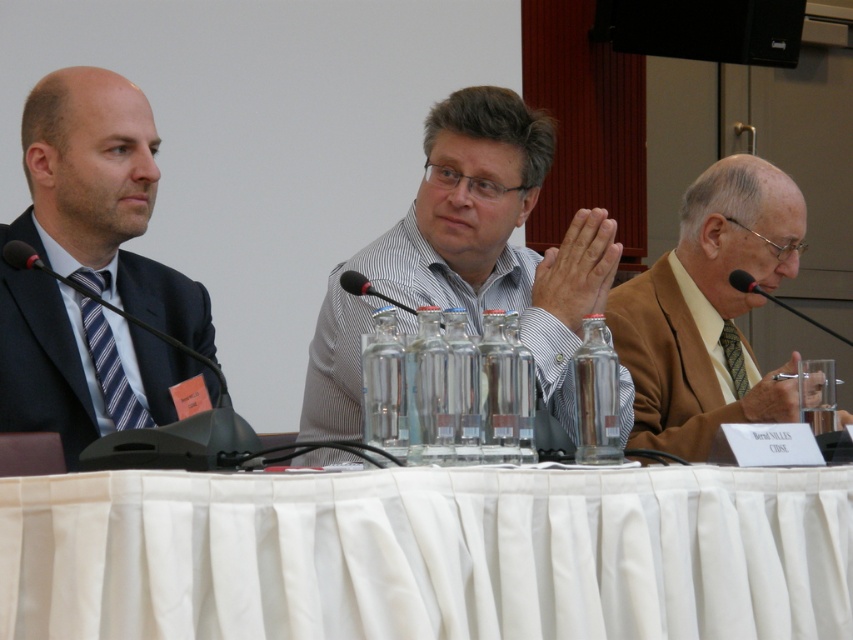
You are sitting at the table and want to hand a document to both the white striped shirt at center and the light brown suit at right. Which one can you reach without moving from your current position?

The white striped shirt at center is closer to the viewer than the light brown suit at right, so you can reach the white striped shirt at center without moving, but you might need to move to reach the light brown suit at right.

You are organizing a photo shoot and need to arrange the white striped shirt at center and the light brown suit at right in a row for a catalog. Which object should be placed first if you want to arrange them from largest to smallest?

The white striped shirt at center should be placed first because it has a larger size compared to the light brown suit at right.

You are standing in front of the table and want to place a small note on the table. You have two points marked on the table where you can place it. The points are at coordinates point (149, 598) and point (670, 24). Which point is closer to you so that you can easily reach it without moving your chair?

Point (149, 598) is closer to the camera than point (670, 24), so you can easily reach it without moving your chair.